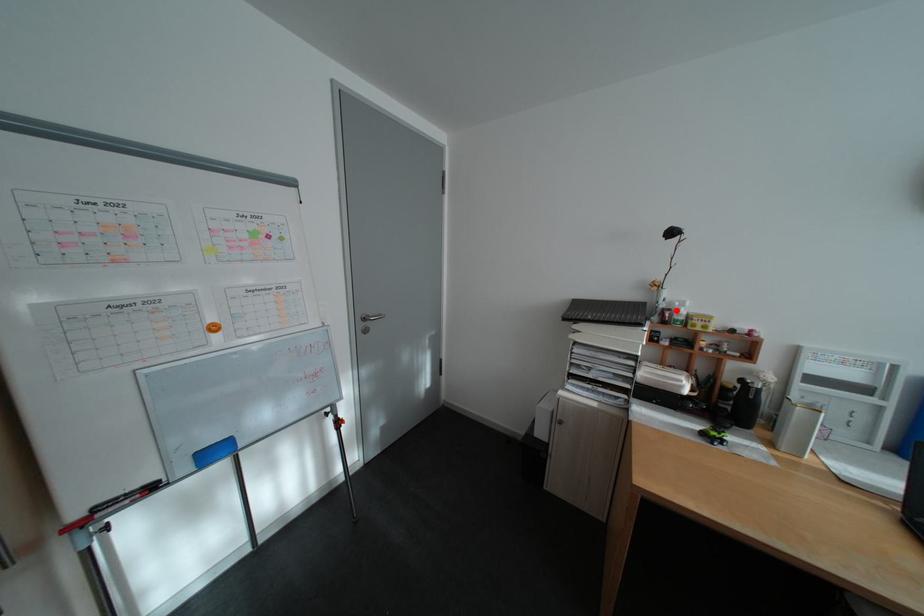
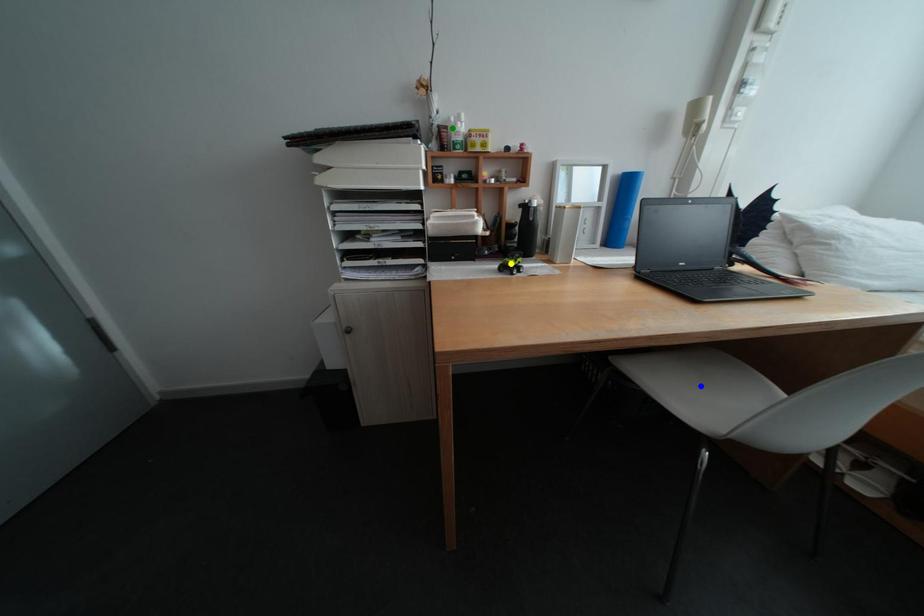
Question: I am providing you with two images of the same scene from different viewpoints. A red point is marked on the first image. You are given multiple points on the second image. Which mark in image 2 goes with the point in image 1?

Choices:
 (A) blue point
 (B) yellow point
 (C) green point

Answer: (C)